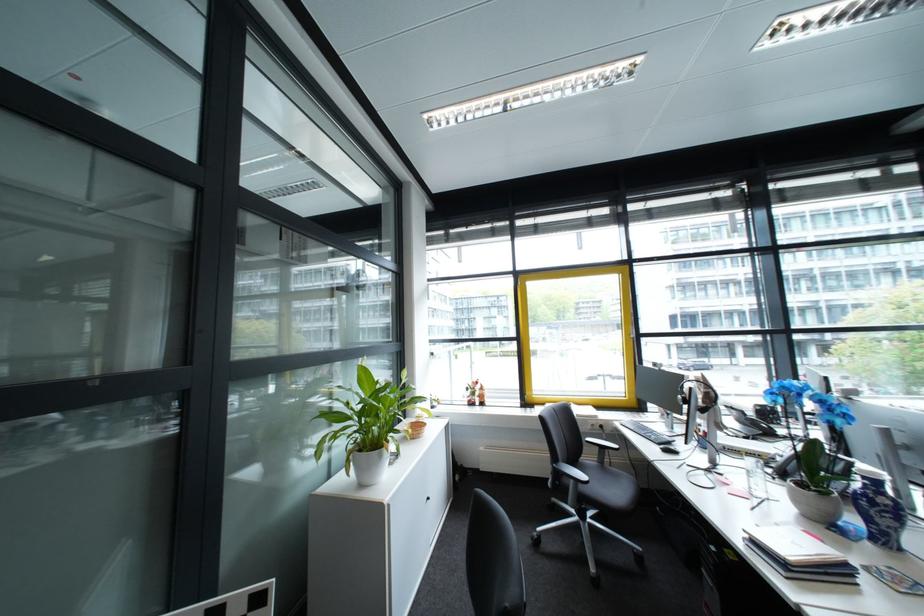
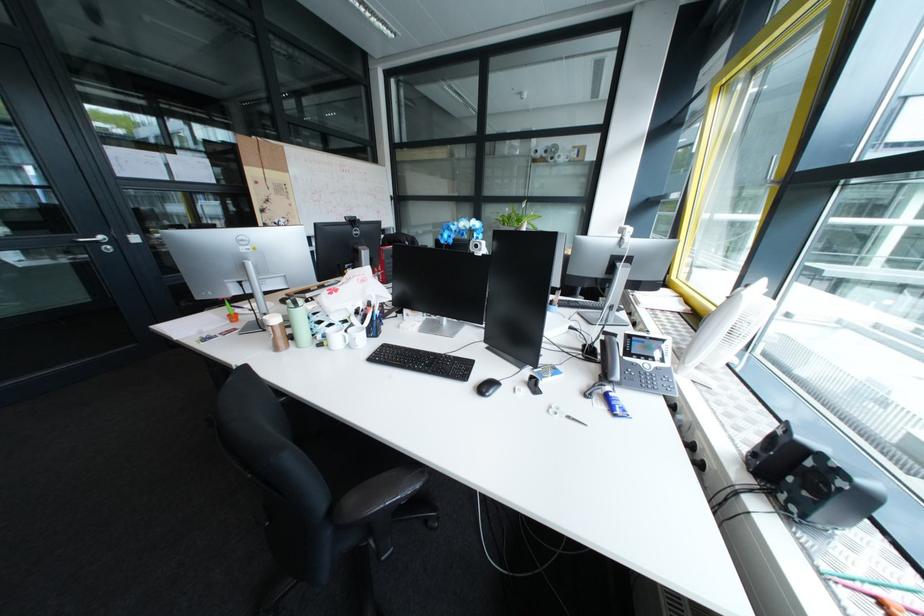
Find the pixel in the second image that matches (783,408) in the first image.

(823, 464)